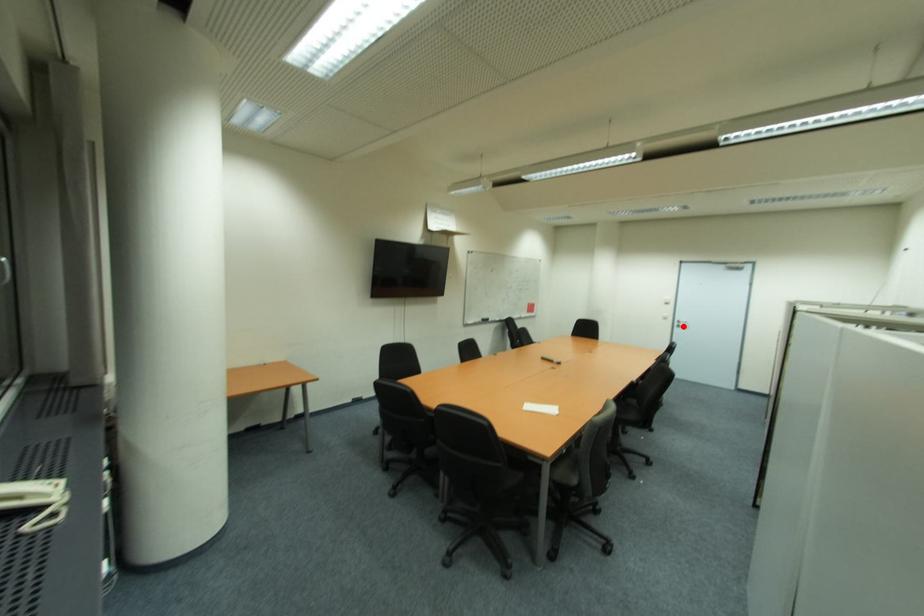
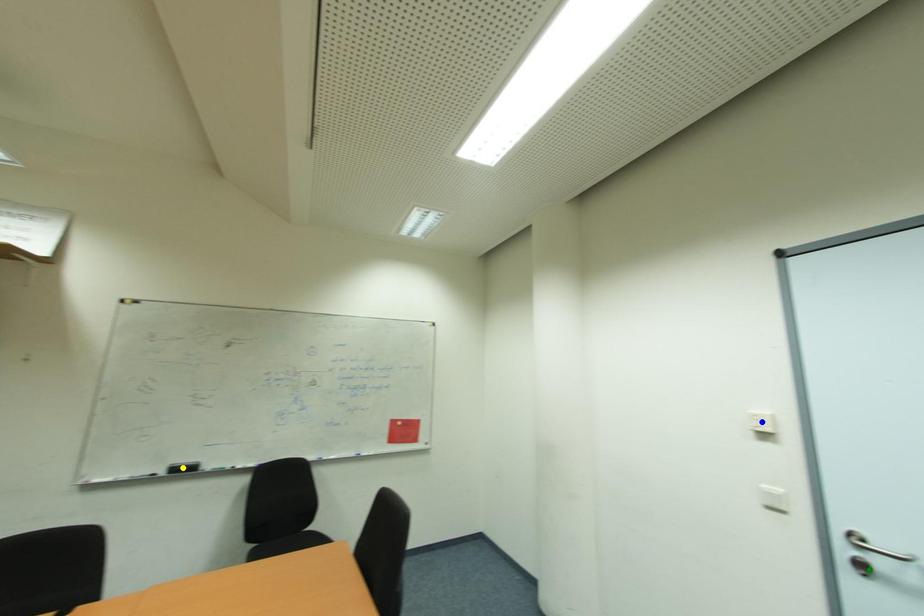
Question: I am providing you with two images of the same scene from different viewpoints. A red point is marked on the first image. You are given multiple points on the second image. Which point in image 2 represents the same 3d spot as the red point in image 1?

Choices:
 (A) green point
 (B) yellow point
 (C) blue point

Answer: (A)